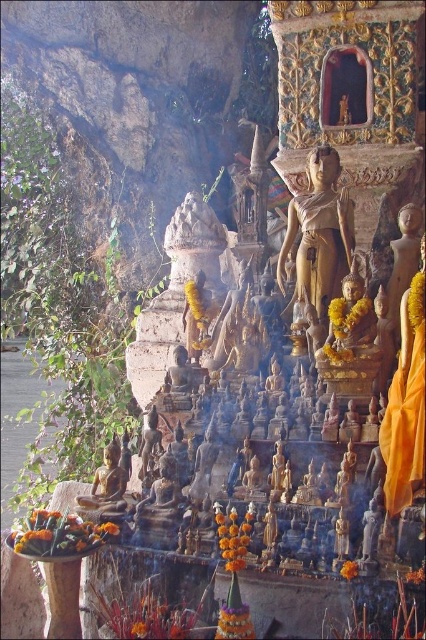
Question: Can you confirm if gold polished statue at center is smaller than bronze statue at lower left?

Choices:
 (A) no
 (B) yes

Answer: (A)

Question: Which point is farther to the camera?

Choices:
 (A) bronze statue at lower left
 (B) gold polished statue at center

Answer: (B)

Question: Does gold polished statue at center have a lesser width compared to bronze statue at lower left?

Choices:
 (A) yes
 (B) no

Answer: (B)

Question: Can you confirm if gold polished statue at center is wider than bronze statue at lower left?

Choices:
 (A) no
 (B) yes

Answer: (B)

Question: Which point is farther from the camera taking this photo?

Choices:
 (A) (97, 477)
 (B) (299, 216)

Answer: (B)

Question: Among these objects, which one is farthest from the camera?

Choices:
 (A) gold polished statue at center
 (B) bronze statue at lower left

Answer: (A)